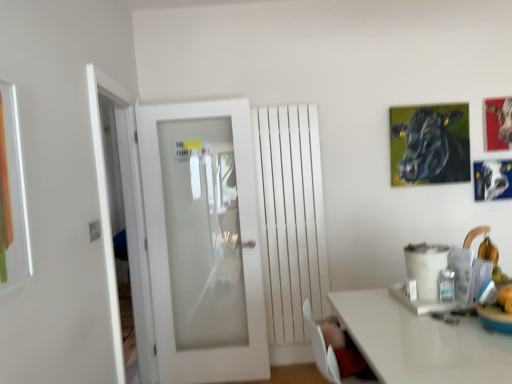
Question: Does white frosted glass door at center come in front of metallic silver picture frame at upper right, which is counted as the third picture frame, starting from the left?

Choices:
 (A) yes
 (B) no

Answer: (A)

Question: Can you confirm if white frosted glass door at center is smaller than metallic silver picture frame at upper right, arranged as the first picture frame when viewed from the right?

Choices:
 (A) yes
 (B) no

Answer: (B)

Question: Is white frosted glass door at center not within metallic silver picture frame at upper right, arranged as the first picture frame when viewed from the right?

Choices:
 (A) no
 (B) yes

Answer: (B)

Question: Does white frosted glass door at center have a lesser height compared to metallic silver picture frame at upper right, arranged as the first picture frame when viewed from the right?

Choices:
 (A) no
 (B) yes

Answer: (A)

Question: Does white frosted glass door at center have a larger size compared to metallic silver picture frame at upper right, arranged as the first picture frame when viewed from the right?

Choices:
 (A) no
 (B) yes

Answer: (B)

Question: From the image's perspective, is white frosted glass door at left positioned above or below white matte radiator at center?

Choices:
 (A) below
 (B) above

Answer: (A)

Question: Looking at the image, does white frosted glass door at left seem bigger or smaller compared to white matte radiator at center?

Choices:
 (A) small
 (B) big

Answer: (B)

Question: Considering their positions, is white frosted glass door at left located in front of or behind white matte radiator at center?

Choices:
 (A) behind
 (B) front

Answer: (B)

Question: Considering the positions of point (142, 279) and point (264, 145), is point (142, 279) closer or farther from the camera than point (264, 145)?

Choices:
 (A) farther
 (B) closer

Answer: (B)

Question: Is white matte radiator at center bigger or smaller than white frosted glass door at left?

Choices:
 (A) small
 (B) big

Answer: (A)

Question: Is point (289, 339) positioned closer to the camera than point (141, 314)?

Choices:
 (A) closer
 (B) farther

Answer: (B)

Question: From a real-world perspective, relative to white frosted glass door at left, is white matte radiator at center vertically above or below?

Choices:
 (A) above
 (B) below

Answer: (A)

Question: In terms of width, does white matte radiator at center look wider or thinner when compared to white frosted glass door at left?

Choices:
 (A) wide
 (B) thin

Answer: (B)

Question: Based on their positions, is white frosted glass door at center located to the left or right of white frosted glass door at left?

Choices:
 (A) left
 (B) right

Answer: (B)

Question: From a real-world perspective, relative to white frosted glass door at left, is white frosted glass door at center vertically above or below?

Choices:
 (A) below
 (B) above

Answer: (A)